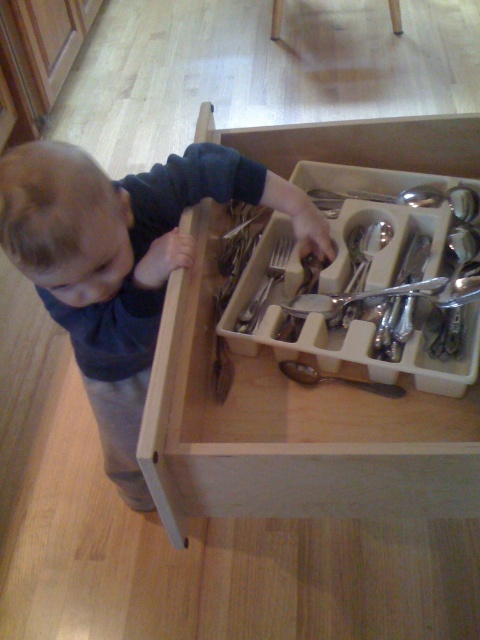
In the scene shown: Who is more distant from viewer, (118, 481) or (253, 321)?

Positioned behind is point (118, 481).

Which is in front, point (152, 269) or point (264, 284)?

Point (152, 269) is in front.

Where is `dark blue shirt at center`? The height and width of the screenshot is (640, 480). dark blue shirt at center is located at coordinates (123, 262).

Does satin silverware at center have a larger size compared to satin silver spoon at center?

Correct, satin silverware at center is larger in size than satin silver spoon at center.

This screenshot has width=480, height=640. What do you see at coordinates (372, 284) in the screenshot?
I see `satin silverware at center` at bounding box center [372, 284].

The width and height of the screenshot is (480, 640). I want to click on satin silverware at center, so click(372, 284).

Is dark blue shirt at center above satin silverware at center?

Incorrect, dark blue shirt at center is not positioned above satin silverware at center.

Is point (235, 188) positioned behind point (450, 346)?

Yes, it is behind point (450, 346).

Is point (140, 305) positioned behind point (286, 243)?

No, (140, 305) is closer to viewer.

The image size is (480, 640). What are the coordinates of `dark blue shirt at center` in the screenshot? It's located at (123, 262).